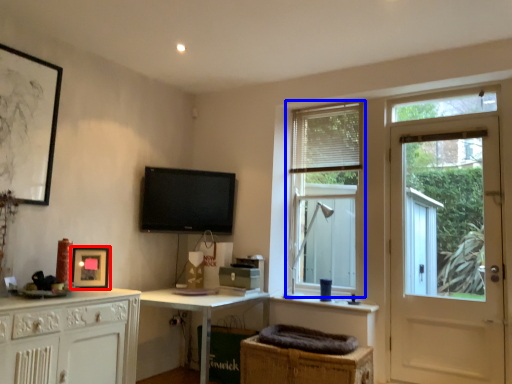
Question: Which of the following is the farthest to the observer, picture frame (highlighted by a red box) or window (highlighted by a blue box)?

Choices:
 (A) picture frame
 (B) window

Answer: (B)